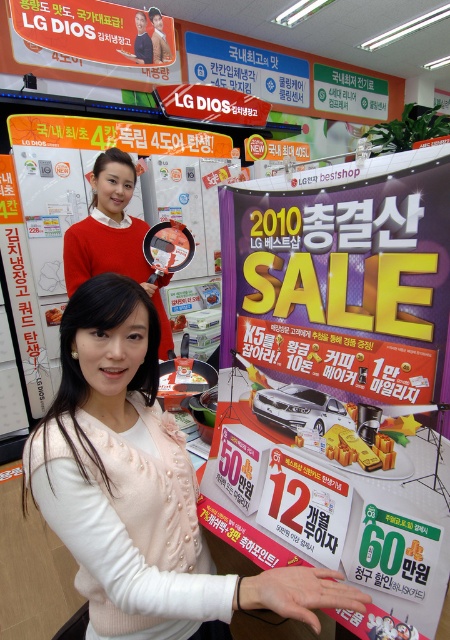
Looking at this image, you are a customer browsing the store and see the pearl white sweater at center and the matte red sweater at upper left. Which sweater is shorter in height?

The pearl white sweater at center has a lesser height compared to the matte red sweater at upper left, so the pearl white sweater at center is shorter in height.

You are a customer in the store and want to pick up the pearl white sweater at center and the matte red sweater at upper left to try on. Which sweater should you reach for first to grab the one closer to you?

The pearl white sweater at center is closer to the viewer than the matte red sweater at upper left, so you should reach for the pearl white sweater at center first.

Based on the photo, you are a photographer trying to capture the pearl white sweater at center in focus while blurring the background. If your camera has a depth of field setting that can blur objects beyond 30 inches away, will the background be sufficiently blurred?

The pearl white sweater at center is 27.46 inches away from the camera. Since the depth of field setting blurs objects beyond 30 inches, the sweater will be in focus, and the background beyond 30 inches will be blurred. However, the sweater itself is within the 30 inches range, so the background beyond that distance will still be blurred, achieving the desired effect.